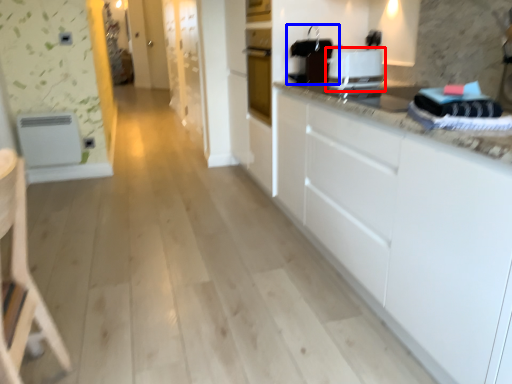
Question: Which of the following is the closest to the observer, home appliance (highlighted by a red box) or appliance (highlighted by a blue box)?

Choices:
 (A) home appliance
 (B) appliance

Answer: (A)